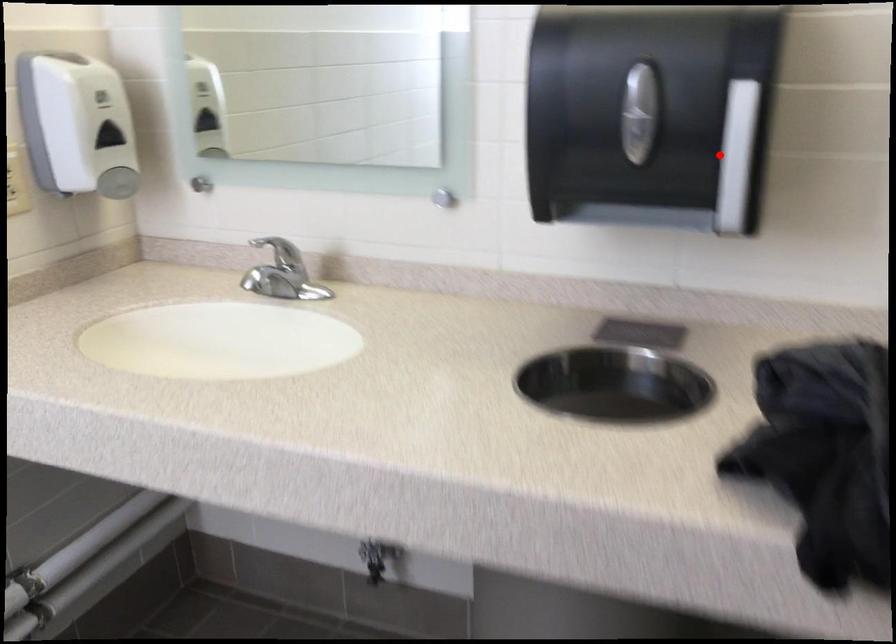
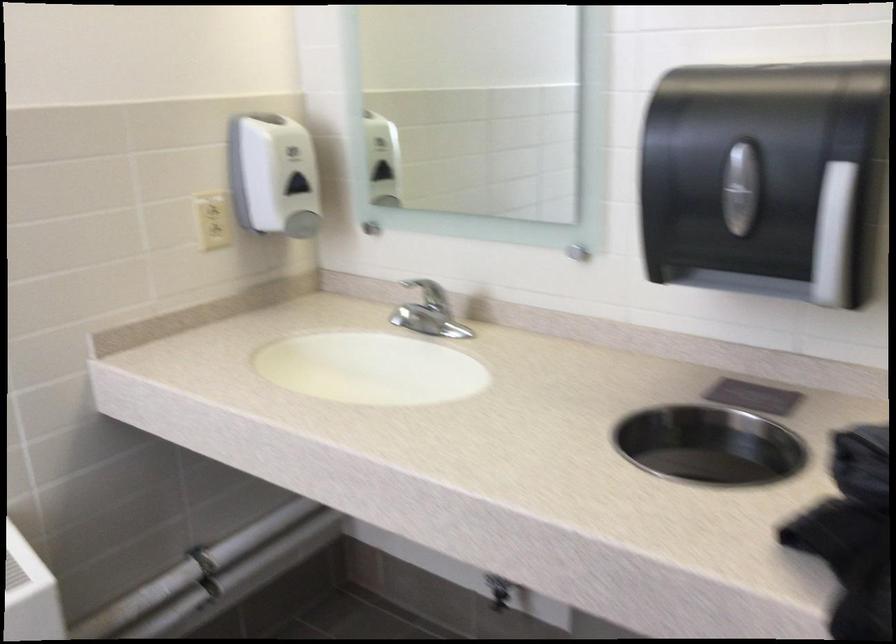
In the second image, find the point that corresponds to the highlighted location in the first image.

(833, 236)